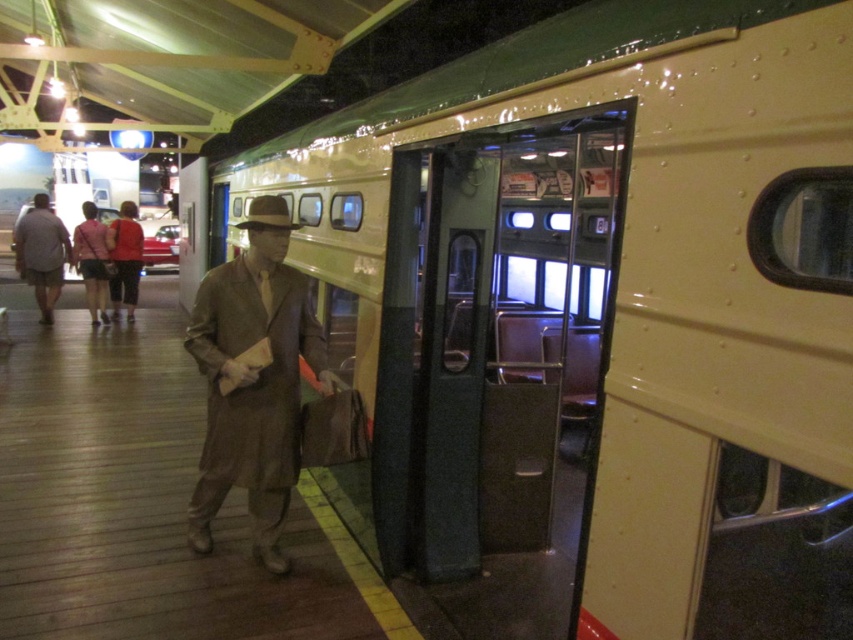
Question: Which of the following is the farthest from the observer?

Choices:
 (A) (270, 518)
 (B) (32, 228)
 (C) (96, 253)

Answer: (C)

Question: Is light beige fabric pants at left positioned behind red fabric jacket at center?

Choices:
 (A) no
 (B) yes

Answer: (A)

Question: Is brown wool coat at center above matte pink jacket at center?

Choices:
 (A) yes
 (B) no

Answer: (B)

Question: Is light beige fabric pants at left above matte pink jacket at center?

Choices:
 (A) no
 (B) yes

Answer: (A)

Question: Which of these objects is positioned closest to the light beige fabric pants at left?

Choices:
 (A) matte pink jacket at center
 (B) brown wool coat at center

Answer: (A)

Question: Which point is farther to the camera?

Choices:
 (A) red fabric jacket at center
 (B) brown wool coat at center
 (C) light beige fabric pants at left

Answer: (A)